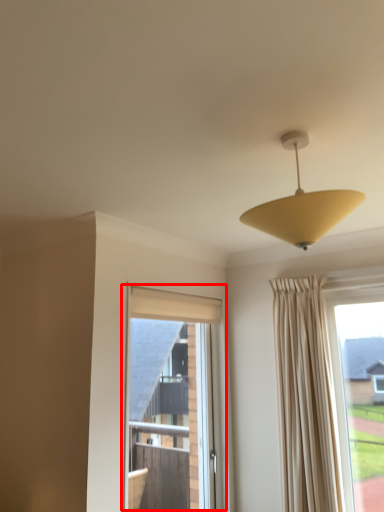
Question: From the image's perspective, where is window (annotated by the red box) located relative to lamp?

Choices:
 (A) above
 (B) below

Answer: (B)